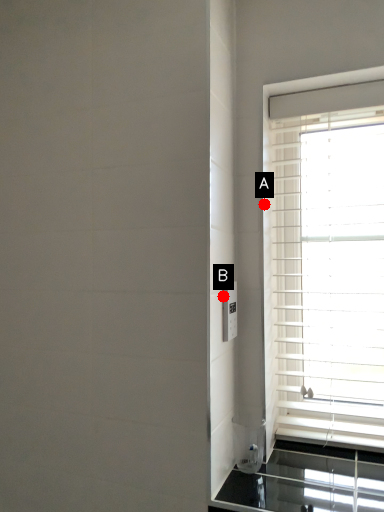
Question: Two points are circled on the image, labeled by A and B beside each circle. Which point is closer to the camera taking this photo?

Choices:
 (A) A is closer
 (B) B is closer

Answer: (B)